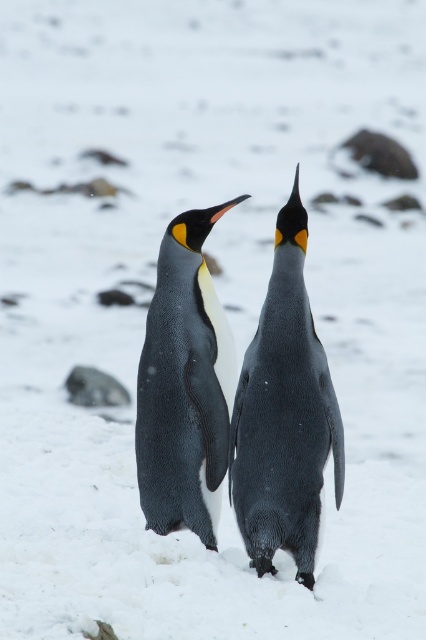
You are a photographer trying to capture the two points in the image. Which point, point [250,548] or point [190,337], is closer to the camera?

Point [250,548] is in front of point [190,337], so it is closer to the camera.

You are a photographer trying to capture the two penguins in the image. Which penguin, the black matte penguin at center or the black glossy penguin at center, is positioned lower in the frame?

The black matte penguin at center is positioned lower in the frame as it is below the black glossy penguin at center.